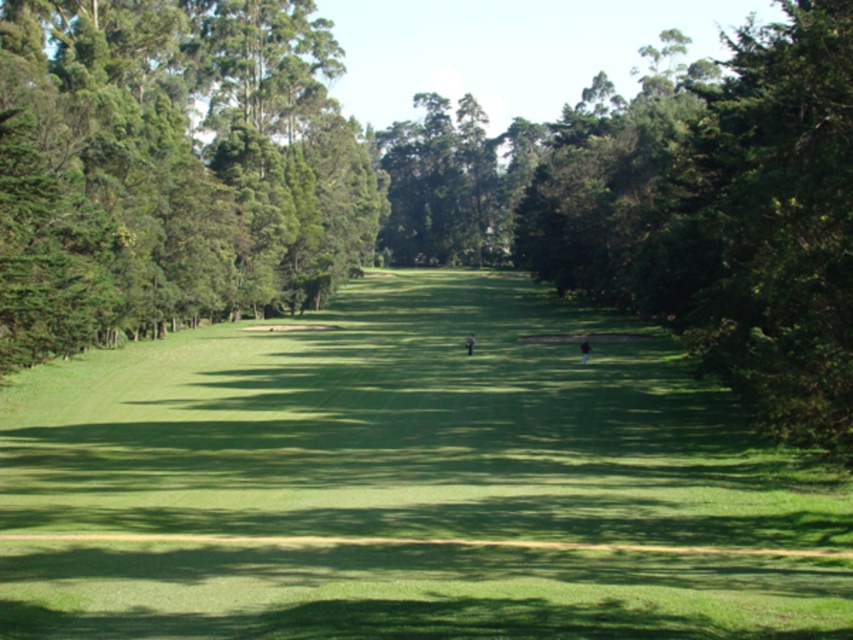
Question: Is green leafy trees at left further to the viewer compared to dark brown leather golfer at center?

Choices:
 (A) no
 (B) yes

Answer: (A)

Question: Which point appears farthest from the camera in this image?

Choices:
 (A) (498, 358)
 (B) (585, 360)
 (C) (469, 344)

Answer: (C)

Question: Estimate the real-world distances between objects in this image. Which object is closer to the green leafy trees at left?

Choices:
 (A) dark brown leather golfer at center
 (B) dark gray fabric golfer at center

Answer: (B)

Question: Where is green grassy field at center located in relation to dark brown leather golfer at center in the image?

Choices:
 (A) below
 (B) above

Answer: (A)

Question: Can you confirm if green grassy field at center is thinner than dark gray fabric golfer at center?

Choices:
 (A) yes
 (B) no

Answer: (B)

Question: Which of the following is the closest to the observer?

Choices:
 (A) (361, 257)
 (B) (584, 349)
 (C) (466, 339)
 (D) (573, 529)

Answer: (D)